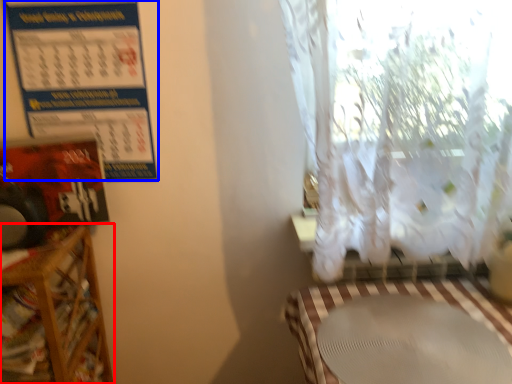
Question: Which object appears closest to the camera in this image, furniture (highlighted by a red box) or calendar (highlighted by a blue box)?

Choices:
 (A) furniture
 (B) calendar

Answer: (A)